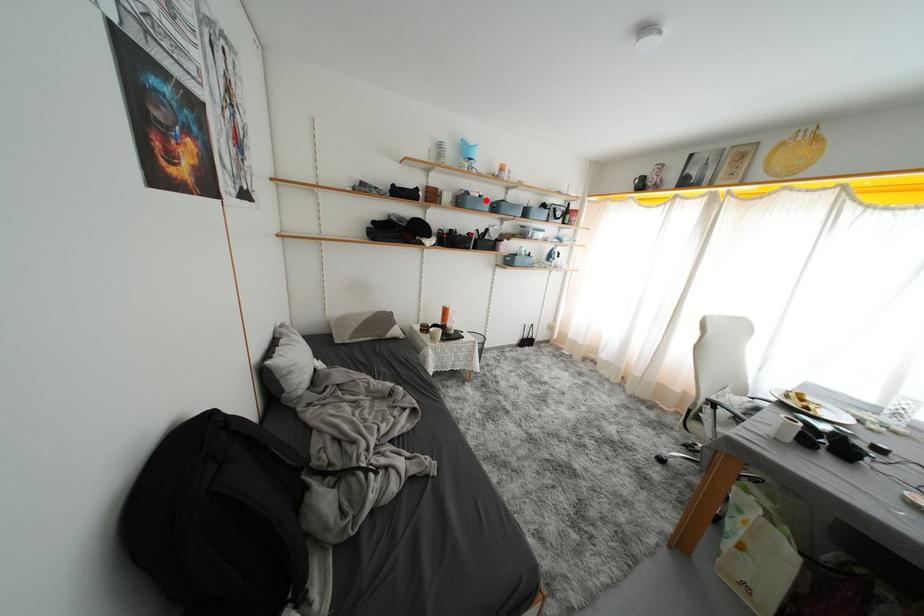
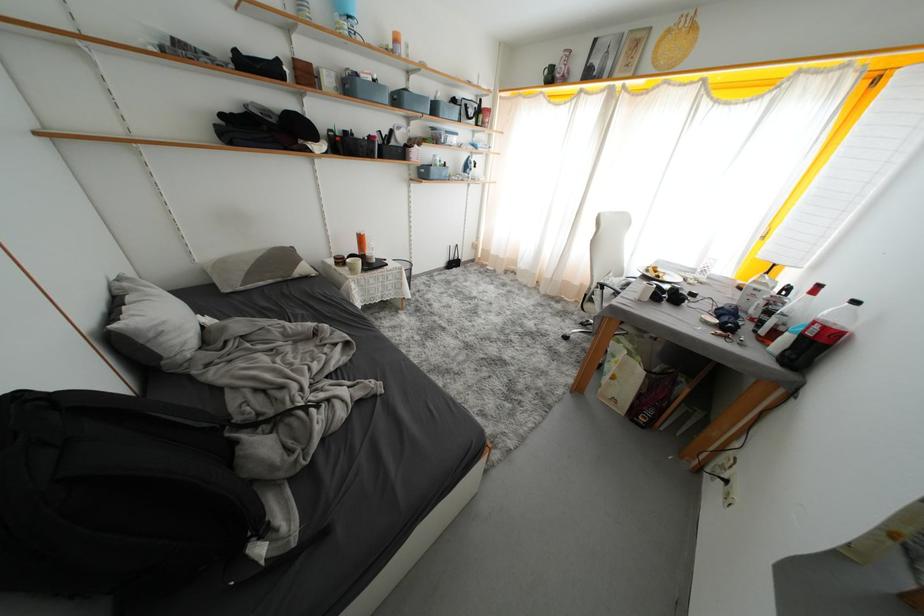
Question: I am providing you with two images of the same scene from different viewpoints. A red point is shown in image1. For the corresponding object point in image2, is it positioned nearer or farther from the camera?

Choices:
 (A) Nearer
 (B) Farther

Answer: (B)